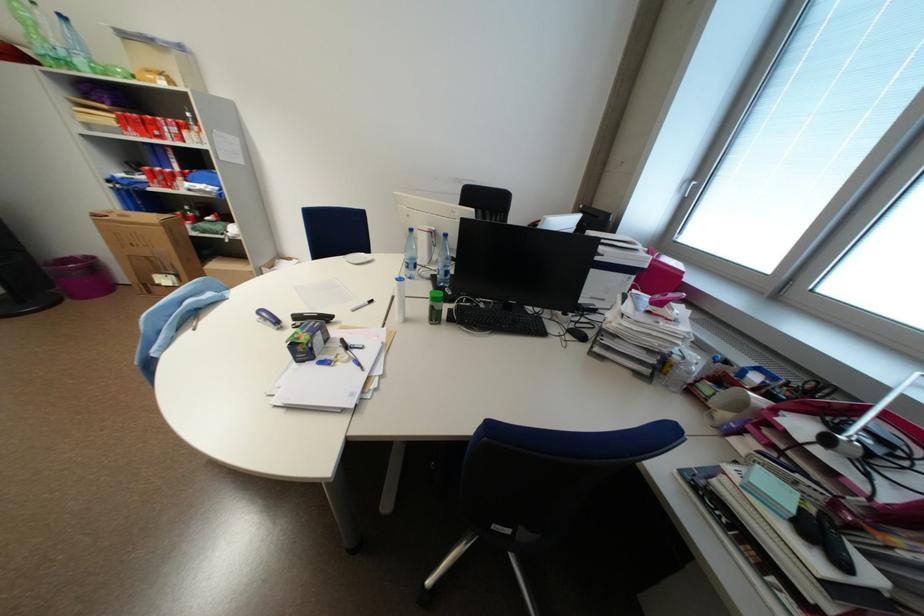
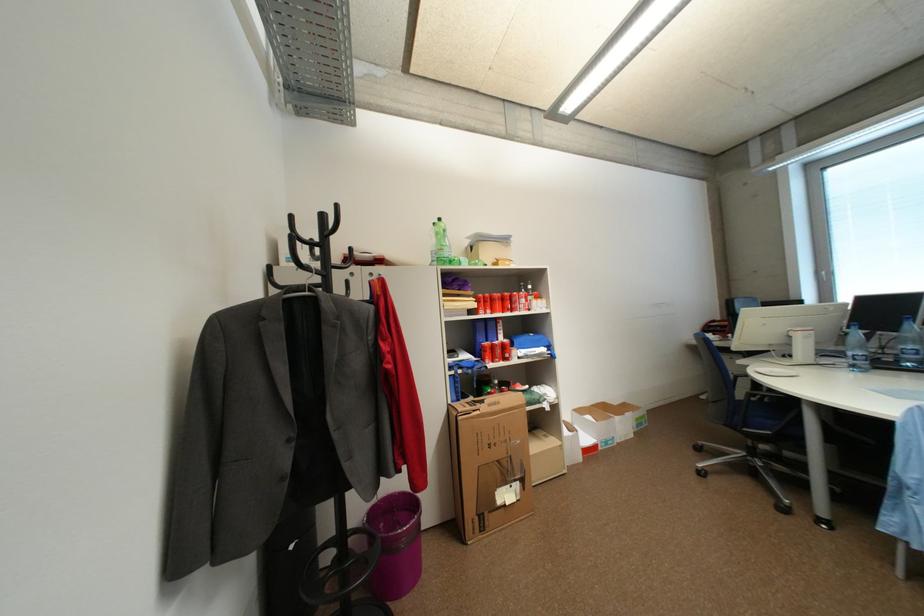
Locate, in the second image, the point that corresponds to point (159, 293) in the first image.

(491, 529)